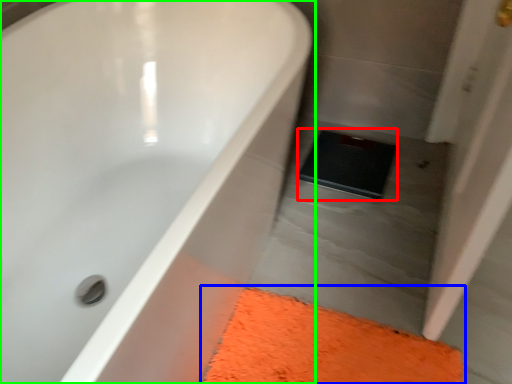
Question: Considering the real-world distances, which object is farthest from pad (highlighted by a red box)? bath mat (highlighted by a blue box) or bathtub (highlighted by a green box)?

Choices:
 (A) bath mat
 (B) bathtub

Answer: (B)